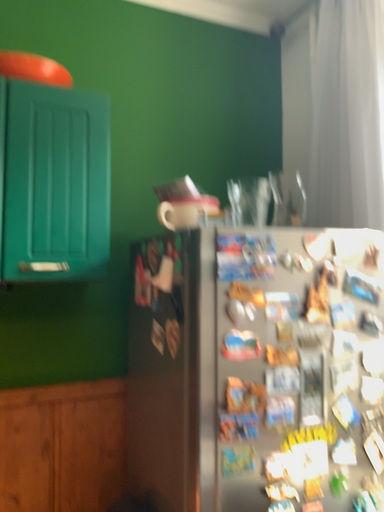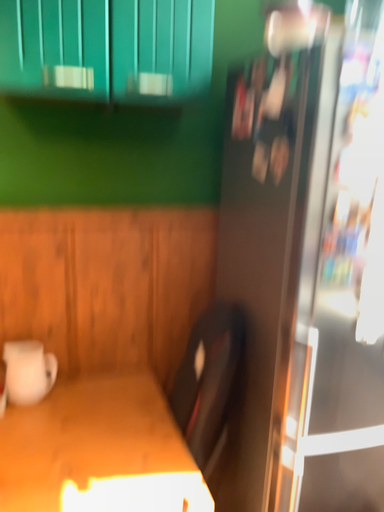
Question: How did the camera likely rotate when shooting the video?

Choices:
 (A) rotated upward
 (B) rotated downward

Answer: (B)